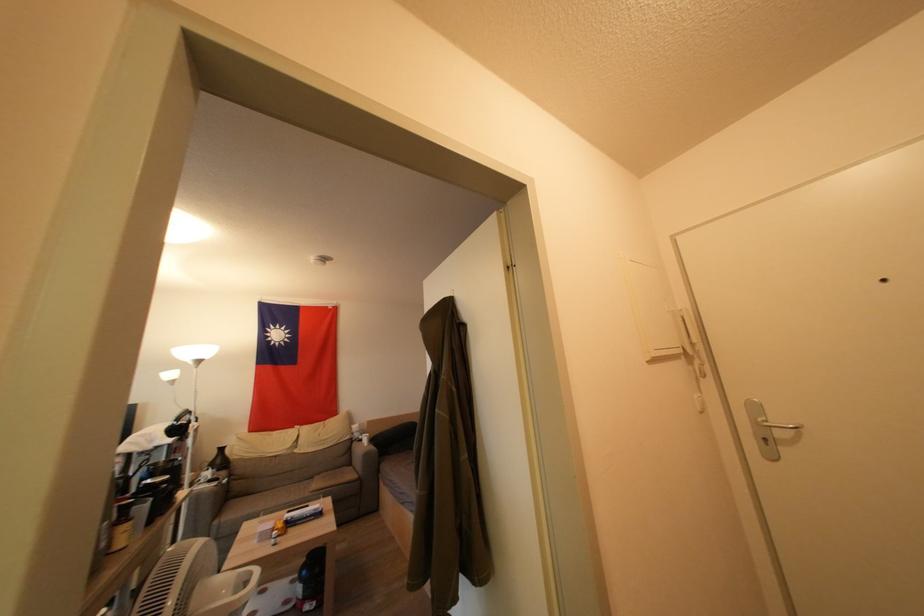
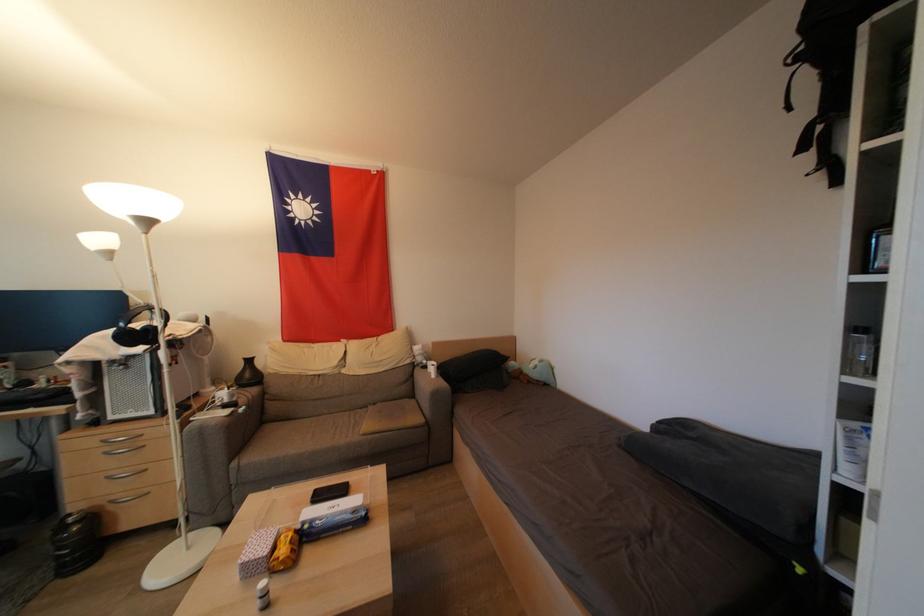
Locate, in the second image, the point that corresponds to point (183, 434) in the first image.

(142, 339)